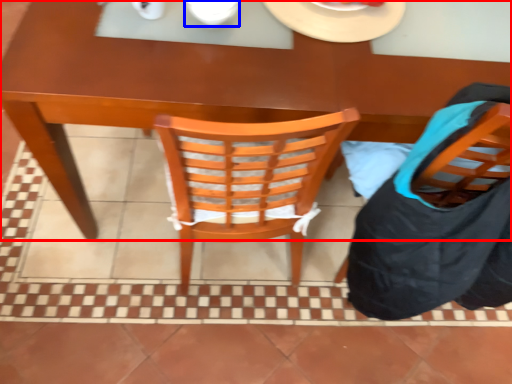
Question: Which object appears farthest to the camera in this image, desk (highlighted by a red box) or tableware (highlighted by a blue box)?

Choices:
 (A) desk
 (B) tableware

Answer: (B)